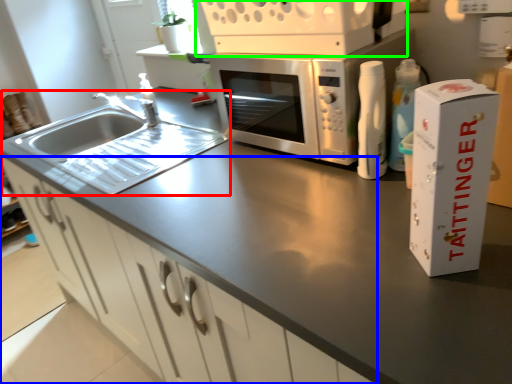
Question: Considering the real-world distances, which object is closest to sink (highlighted by a red box)? cabinetry (highlighted by a blue box) or appliance (highlighted by a green box).

Choices:
 (A) cabinetry
 (B) appliance

Answer: (A)